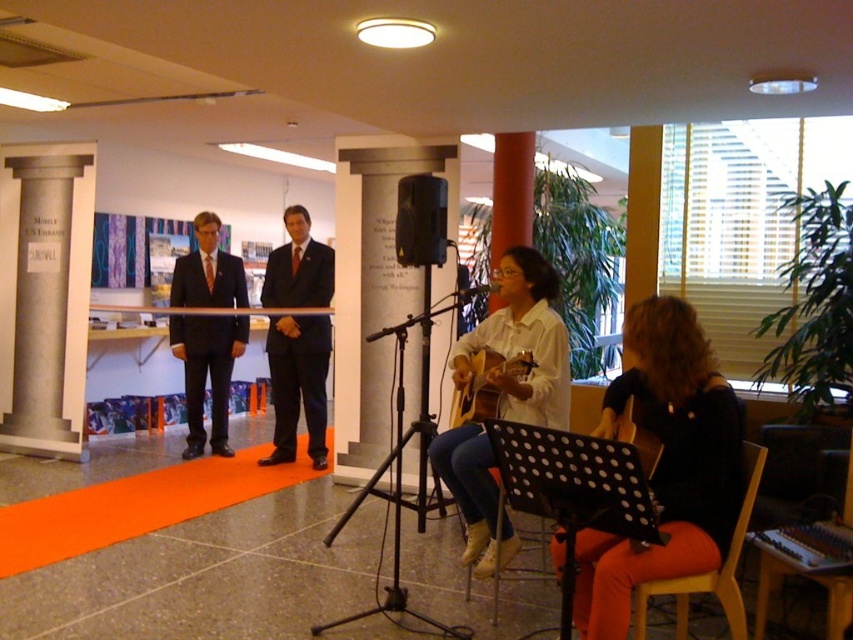
Does black fabric guitar at lower right come in front of black plastic speaker at center?

Yes, it is.

Is point (717, 486) positioned after point (430, 173)?

That is False.

Where is `black fabric guitar at lower right`? The width and height of the screenshot is (853, 640). black fabric guitar at lower right is located at coordinates (665, 464).

Is point (592, 532) in front of point (677, 602)?

Yes, it is in front of point (677, 602).

Can you confirm if black fabric guitar at lower right is positioned below orange fabric chair at lower right?

Actually, black fabric guitar at lower right is above orange fabric chair at lower right.

Where is `black fabric guitar at lower right`? Image resolution: width=853 pixels, height=640 pixels. black fabric guitar at lower right is located at coordinates (665, 464).

Does matte white shirt at center appear under matte black suit at center?

Indeed, matte white shirt at center is positioned under matte black suit at center.

Between matte white shirt at center and matte black suit at center, which one appears on the right side from the viewer's perspective?

matte white shirt at center

Is point (543, 349) in front of point (223, 413)?

Yes.

Find the location of a particular element. The height and width of the screenshot is (640, 853). matte white shirt at center is located at coordinates (523, 342).